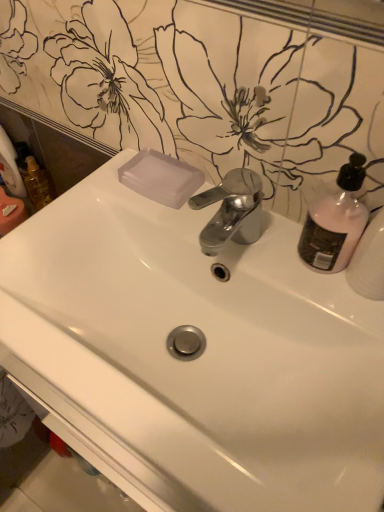
This screenshot has height=512, width=384. Identify the location of free space in front of pink matte bottle at upper right. (337, 326).